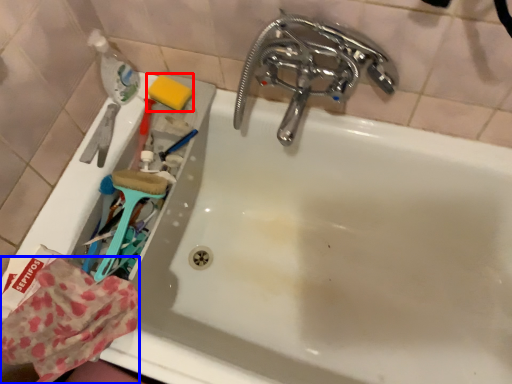
Question: Which object is further to the camera taking this photo, soap (highlighted by a red box) or material (highlighted by a blue box)?

Choices:
 (A) soap
 (B) material

Answer: (A)